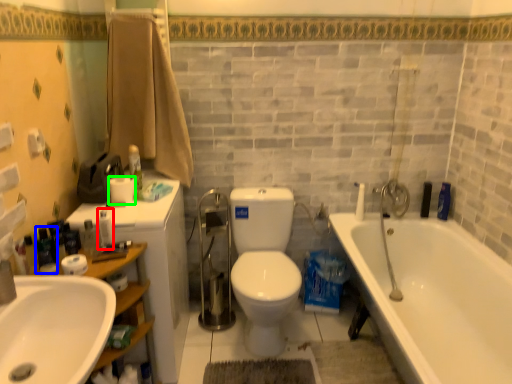
Question: Which is farther away from toiletry (highlighted by a red box)? toiletry (highlighted by a blue box) or toilet paper (highlighted by a green box)?

Choices:
 (A) toiletry
 (B) toilet paper

Answer: (A)